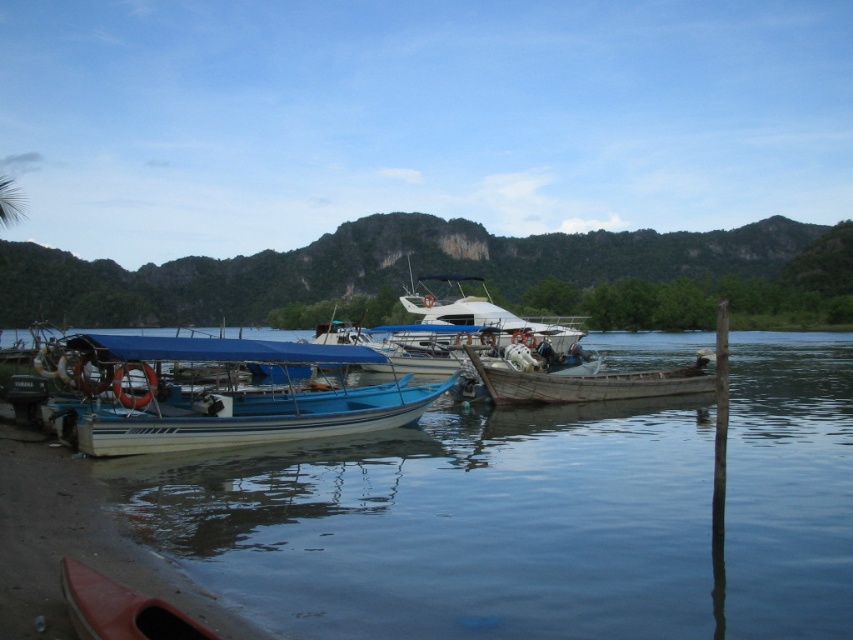
Question: Which point is closer to the camera?

Choices:
 (A) (527, 323)
 (B) (618, 394)
 (C) (91, 612)

Answer: (C)

Question: Is wooden boat at center below matte orange canoe at lower left?

Choices:
 (A) yes
 (B) no

Answer: (B)

Question: Which of the following is the farthest from the observer?

Choices:
 (A) blue matte boat at center
 (B) matte orange canoe at lower left

Answer: (A)

Question: Among these objects, which one is farthest from the camera?

Choices:
 (A) white glossy yacht at center
 (B) blue matte boat at center
 (C) matte orange canoe at lower left

Answer: (A)

Question: Observing the image, what is the correct spatial positioning of blue matte boat at center in reference to matte orange canoe at lower left?

Choices:
 (A) above
 (B) below

Answer: (B)

Question: Is wooden boat at center thinner than white glossy yacht at center?

Choices:
 (A) no
 (B) yes

Answer: (A)